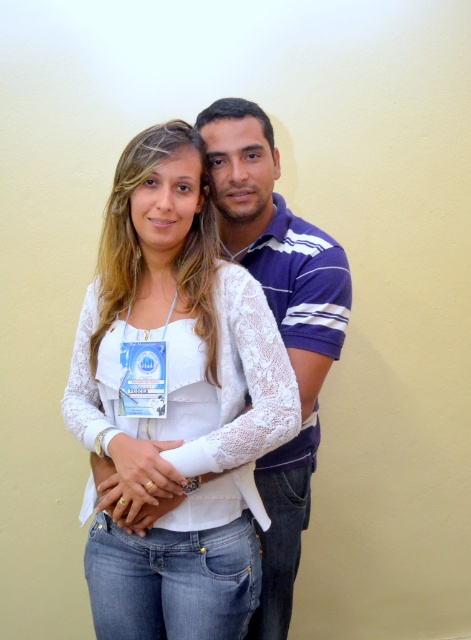
Question: Which of the following is the farthest from the observer?

Choices:
 (A) blue striped polo shirt at center
 (B) white lace top at center

Answer: (A)

Question: Which object appears farthest from the camera in this image?

Choices:
 (A) blue striped polo shirt at center
 (B) white lace top at center

Answer: (A)

Question: Is white lace top at center bigger than blue striped polo shirt at center?

Choices:
 (A) yes
 (B) no

Answer: (B)

Question: Is white lace top at center to the left of blue striped polo shirt at center from the viewer's perspective?

Choices:
 (A) yes
 (B) no

Answer: (A)

Question: Can you confirm if white lace top at center is wider than blue striped polo shirt at center?

Choices:
 (A) no
 (B) yes

Answer: (B)